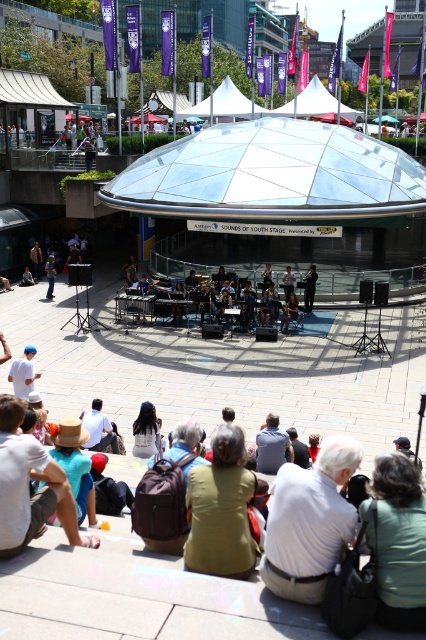
Question: Can you confirm if dark blue shirt at center is wider than denim jacket at lower left?

Choices:
 (A) no
 (B) yes

Answer: (B)

Question: Among these points, which one is nearest to the camera?

Choices:
 (A) (199, 502)
 (B) (299, 566)
 (C) (314, 224)
 (D) (51, 257)

Answer: (B)

Question: In this image, where is green fabric jacket at lower center located relative to denim jacket at lower left?

Choices:
 (A) right
 (B) left

Answer: (A)

Question: Which object is the farthest from the transparent glass dome at center?

Choices:
 (A) white cotton shirt at lower center
 (B) dark blue shirt at center

Answer: (A)

Question: Which object is the closest to the green fabric jacket at lower center?

Choices:
 (A) dark blue shirt at center
 (B) denim jacket at lower left
 (C) transparent glass dome at center
 (D) white cotton shirt at lower center

Answer: (D)

Question: Is transparent glass dome at center in front of white cotton shirt at lower center?

Choices:
 (A) yes
 (B) no

Answer: (B)